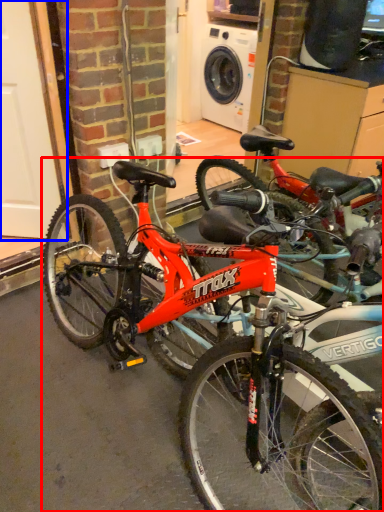
Question: Among these objects, which one is nearest to the camera, bicycle (highlighted by a red box) or garage door (highlighted by a blue box)?

Choices:
 (A) bicycle
 (B) garage door

Answer: (A)